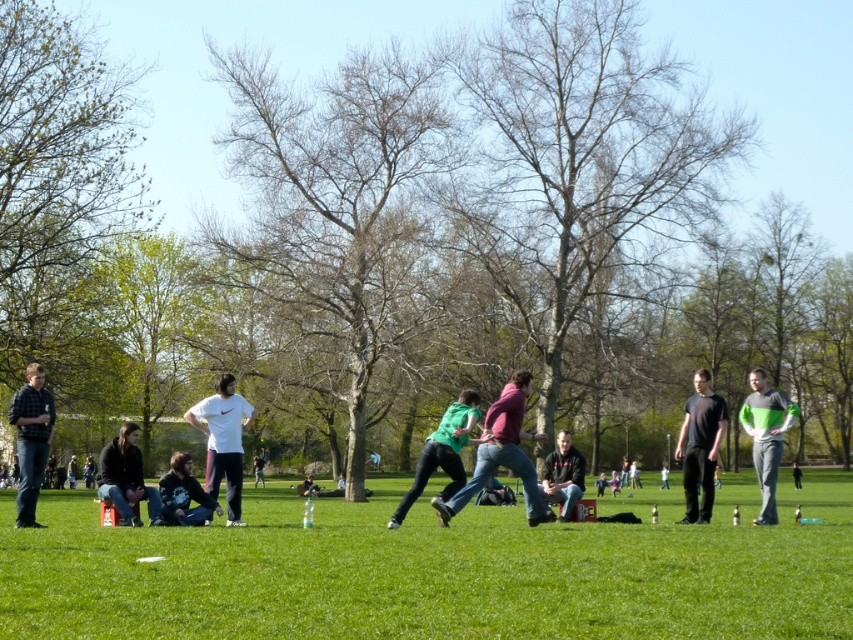
Question: Which of the following is the closest to the observer?

Choices:
 (A) green matte shirt at center
 (B) light gray hoodie at center
 (C) dark gray hoodie at center

Answer: (A)

Question: Which point is closer to the camera taking this photo?

Choices:
 (A) (171, 472)
 (B) (444, 456)
 (C) (32, 378)

Answer: (B)

Question: From the image, what is the correct spatial relationship of black matte shirt at center in relation to dark gray hoodie at center?

Choices:
 (A) above
 (B) below

Answer: (A)

Question: Is black matte shirt at center thinner than dark gray hoodie at center?

Choices:
 (A) yes
 (B) no

Answer: (A)

Question: Is plaid flannel shirt at left in front of green matte shirt at center?

Choices:
 (A) no
 (B) yes

Answer: (B)

Question: Which object appears closest to the camera in this image?

Choices:
 (A) dark gray sweater at center
 (B) green fabric shirt at center

Answer: (B)